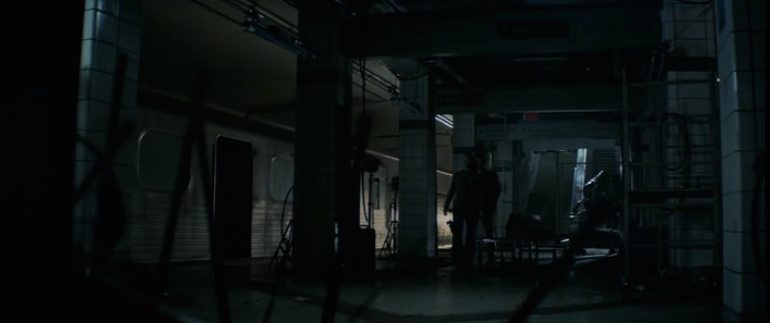
The image size is (770, 323). I want to click on door, so tap(233, 203), tap(377, 204).